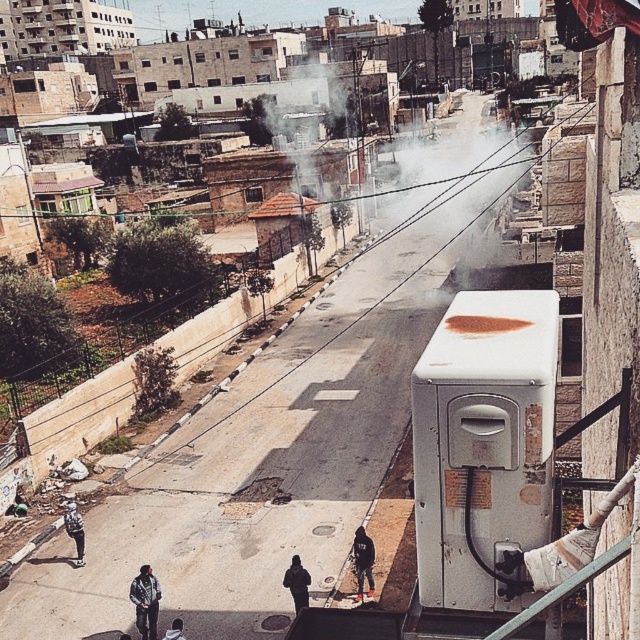
Question: Is dark blue jeans at center bigger than dark gray jacket at center?

Choices:
 (A) no
 (B) yes

Answer: (A)

Question: Which object appears farthest from the camera in this image?

Choices:
 (A) dark gray jacket at lower left
 (B) dark blue jeans at center
 (C) dark gray jacket at center
 (D) dark gray hoodie at lower center

Answer: (B)

Question: Which is nearer to the dark blue jeans at center?

Choices:
 (A) dark gray hoodie at lower center
 (B) dark gray jacket at center
 (C) dark blue jeans at lower left

Answer: (B)

Question: Considering the relative positions of dark gray jacket at lower left and dark gray hoodie at lower center in the image provided, where is dark gray jacket at lower left located with respect to dark gray hoodie at lower center?

Choices:
 (A) below
 (B) above

Answer: (A)

Question: Is dark gray jacket at center positioned behind dark gray hoodie at lower center?

Choices:
 (A) yes
 (B) no

Answer: (A)

Question: Among these points, which one is farthest from the camera?

Choices:
 (A) (134, 598)
 (B) (180, 625)
 (C) (369, 556)
 (D) (81, 538)

Answer: (D)